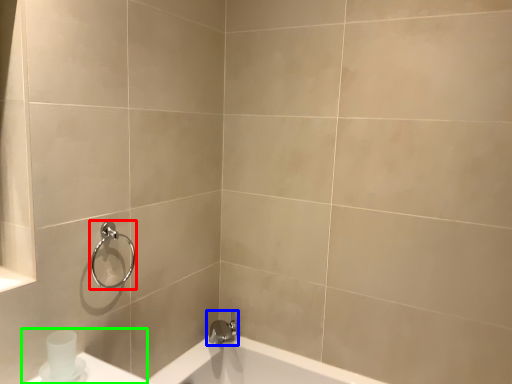
Question: Which is nearer to the shower (highlighted by a red box)? tap (highlighted by a blue box) or sink (highlighted by a green box).

Choices:
 (A) tap
 (B) sink

Answer: (B)